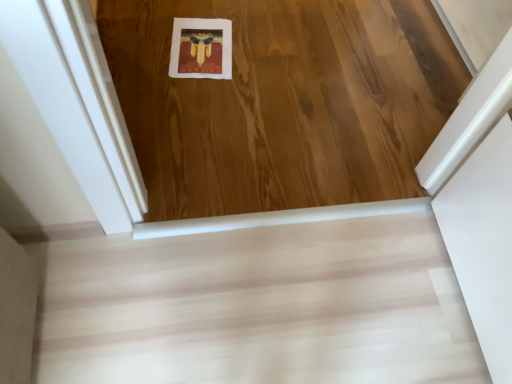
At what (x,y) coordinates should I click in order to perform the action: click on light wood stairwell at lower center. Please return your answer as a coordinate pair (x, y). Image resolution: width=512 pixels, height=384 pixels. Looking at the image, I should click on (257, 307).

What do you see at coordinates (257, 307) in the screenshot?
I see `light wood stairwell at lower center` at bounding box center [257, 307].

You are a GUI agent. You are given a task and a screenshot of the screen. Output one action in this format:
    pyautogui.click(x=<x>, y=<y>)
    Task: Click on the light wood stairwell at lower center
    The height and width of the screenshot is (384, 512).
    Given the screenshot: What is the action you would take?
    pyautogui.click(x=257, y=307)